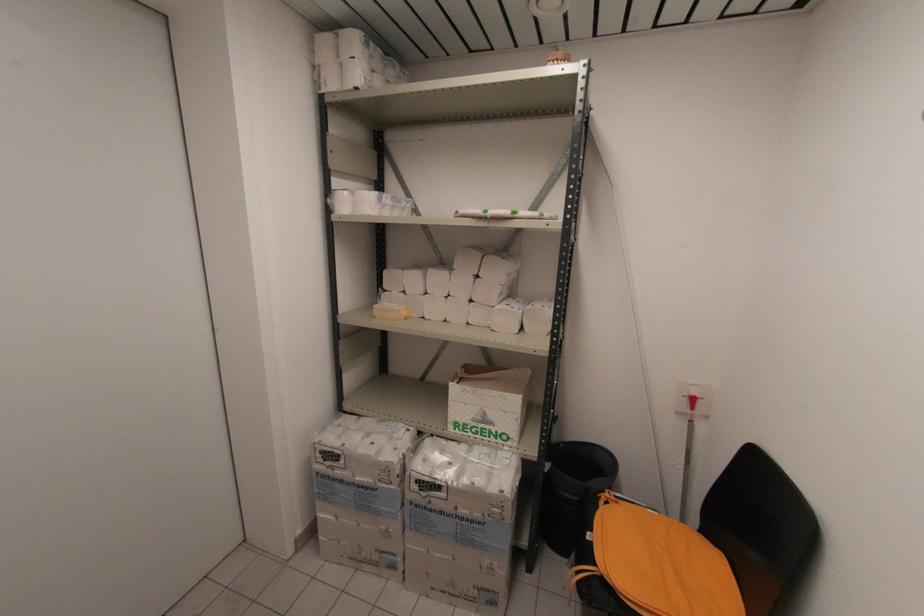
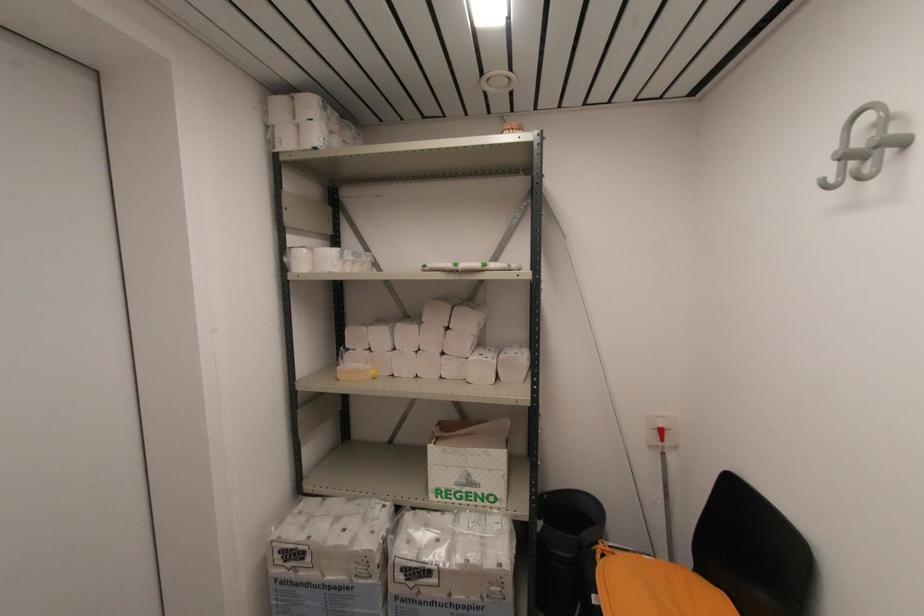
Find the pixel in the second image that matches the point at 618,504 in the first image.

(614, 554)